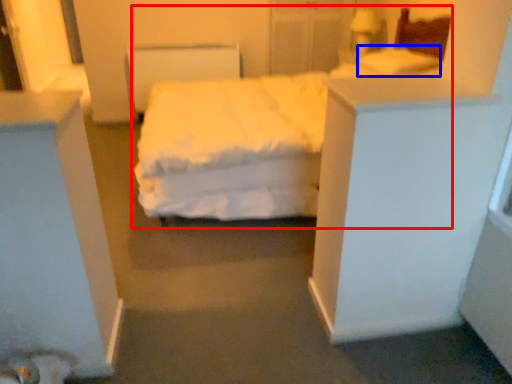
Question: Which point is closer to the camera, bed (highlighted by a red box) or pillow (highlighted by a blue box)?

Choices:
 (A) bed
 (B) pillow

Answer: (A)